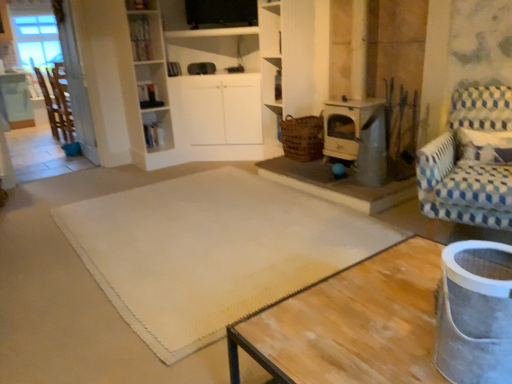
Measure the distance between brown woven basket at center-right and camera.

brown woven basket at center-right is 12.67 feet from camera.

Describe the element at coordinates (56, 105) in the screenshot. I see `wooden chair at left, which is the second chair in front-to-back order` at that location.

Consider the image. In order to face metallic stove at center-right, should I rotate leftwards or rightwards?

It's best to rotate right around 15.098 degrees.

Image resolution: width=512 pixels, height=384 pixels. I want to click on metallic stove at center-right, so click(358, 137).

This screenshot has height=384, width=512. What do you see at coordinates (211, 251) in the screenshot?
I see `white textured mat at center` at bounding box center [211, 251].

Locate an element on the screen. The width and height of the screenshot is (512, 384). brown woven basket at center-right is located at coordinates (302, 137).

Which is in front, point (284, 151) or point (16, 123)?

The point (284, 151) is closer to the camera.

Who is bigger, brown woven basket at center-right or brushed metal table at left?

brushed metal table at left.

From the picture: Is brushed metal table at left at the back of brown woven basket at center-right?

No.

From a real-world perspective, is brown woven basket at center-right located higher than brushed metal table at left?

Actually, brown woven basket at center-right is physically below brushed metal table at left in the real world.

From a real-world perspective, which is physically below, brushed metal table at left or wooden chair at left, the 1th chair in the back-to-front sequence?

From a 3D spatial view, brushed metal table at left is below.

What's the angular difference between brushed metal table at left and wooden chair at left, the 1th chair in the back-to-front sequence,'s facing directions?

There is a 87.9-degree angle between the facing directions of brushed metal table at left and wooden chair at left, the 1th chair in the back-to-front sequence.

Is point (19, 82) closer or farther from the camera than point (49, 102)?

Point (19, 82) appears to be farther away from the viewer than point (49, 102).

Is brushed metal table at left in contact with wooden chair at left, which is counted as the first chair, starting from the left?

No, brushed metal table at left is not with wooden chair at left, which is counted as the first chair, starting from the left.

Is wooden chair at left, which is counted as the first chair, starting from the left, to the left of brushed metal table at left from the viewer's perspective?

No.

In terms of width, does wooden chair at left, the first chair viewed from the top, look wider or thinner when compared to brushed metal table at left?

Considering their sizes, wooden chair at left, the first chair viewed from the top, looks slimmer than brushed metal table at left.

Is the depth of wooden chair at left, which is the second chair in front-to-back order, greater than that of brushed metal table at left?

No, it is in front of brushed metal table at left.

From a real-world perspective, does wooden chair at left, the 1th chair in the back-to-front sequence, sit lower than brushed metal table at left?

No.

Looking at this image, which is closer to the camera, (56, 66) or (468, 219)?

Point (56, 66) is farther from the camera than point (468, 219).

Could you tell me if wooden chair at left, which is the second chair in front-to-back order, is turned towards blue and white checkered fabric armchair at right, positioned as the 1th chair in right-to-left order?

No.

Is wooden chair at left, which appears as the 2th chair when ordered from the bottom, closer to camera compared to blue and white checkered fabric armchair at right, positioned as the 1th chair in right-to-left order?

That is False.

From the image's perspective, is wooden chair at left, the 1th chair in the back-to-front sequence, below blue and white checkered fabric armchair at right, arranged as the first chair when viewed from the front?

No, from the image's perspective, wooden chair at left, the 1th chair in the back-to-front sequence, is not beneath blue and white checkered fabric armchair at right, arranged as the first chair when viewed from the front.

In terms of width, does white glossy bookshelf at upper center look wider or thinner when compared to brown woven basket at center-right?

Clearly, white glossy bookshelf at upper center has less width compared to brown woven basket at center-right.

Considering the positions of objects white glossy bookshelf at upper center and brown woven basket at center-right in the image provided, who is more to the left, white glossy bookshelf at upper center or brown woven basket at center-right?

From the viewer's perspective, white glossy bookshelf at upper center appears more on the left side.

Which of these two, white glossy bookshelf at upper center or brown woven basket at center-right, is bigger?

Bigger between the two is brown woven basket at center-right.

From the image's perspective, which one is positioned lower, white glossy bookshelf at upper center or brown woven basket at center-right?

brown woven basket at center-right.

Considering the points (27, 125) and (127, 7), which point is in front, point (27, 125) or point (127, 7)?

The point (127, 7) is closer to the camera.

Find the location of `table that is behind the white glossy bookshelf at upper center`. table that is behind the white glossy bookshelf at upper center is located at coordinates (16, 101).

Can you tell me how much brushed metal table at left and white glossy bookshelf at upper center differ in facing direction?

1.19 degrees.

In terms of height, does brushed metal table at left look taller or shorter compared to white glossy bookshelf at upper center?

Clearly, brushed metal table at left is taller compared to white glossy bookshelf at upper center.

Is white glossy bookshelf at upper center taller or shorter than brushed metal table at left?

white glossy bookshelf at upper center is shorter than brushed metal table at left.

The image size is (512, 384). Find the location of `table behind the white glossy bookshelf at upper center`. table behind the white glossy bookshelf at upper center is located at coordinates (16, 101).

Is white glossy bookshelf at upper center oriented towards brushed metal table at left?

No, white glossy bookshelf at upper center is not turned towards brushed metal table at left.

Is white glossy bookshelf at upper center located outside brushed metal table at left?

Indeed, white glossy bookshelf at upper center is completely outside brushed metal table at left.

At what (x,y) coordinates should I click in order to perform the action: click on basket below the brushed metal table at left (from a real-world perspective). Please return your answer as a coordinate pair (x, y). This screenshot has height=384, width=512. Looking at the image, I should click on (302, 137).

In order to click on table located above the wooden chair at left, which appears as the 2th chair when ordered from the bottom (from the image's perspective) in this screenshot , I will do `click(16, 101)`.

Considering their positions, is brown woven basket at center-right positioned further to white glossy bookshelf at upper center than metallic stove at center-right?

metallic stove at center-right.

Looking at the image, which one is located further to blue and white checkered fabric armchair at right, arranged as the first chair when viewed from the front, brushed metal table at left or metallic stove at center-right?

brushed metal table at left lies further to blue and white checkered fabric armchair at right, arranged as the first chair when viewed from the front, than the other object.

Based on their spatial positions, is blue and white checkered fabric armchair at right, acting as the 2th chair starting from the top, or white glossy bookshelf at upper center further from brushed metal table at left?

blue and white checkered fabric armchair at right, acting as the 2th chair starting from the top, is positioned further to the anchor brushed metal table at left.

Based on their spatial positions, is blue and white checkered fabric armchair at right, arranged as the first chair when viewed from the front, or white textured mat at center closer to brown woven basket at center-right?

white textured mat at center is closer to brown woven basket at center-right.

Based on their spatial positions, is brown woven basket at center-right or blue and white checkered fabric armchair at right, acting as the second chair starting from the left, closer to white glossy bookshelf at upper center?

Based on the image, brown woven basket at center-right appears to be nearer to white glossy bookshelf at upper center.

Looking at the image, which one is located further to wooden chair at left, which appears as the 2th chair when ordered from the bottom, white textured mat at center or blue and white checkered fabric armchair at right, acting as the second chair starting from the left?

blue and white checkered fabric armchair at right, acting as the second chair starting from the left, lies further to wooden chair at left, which appears as the 2th chair when ordered from the bottom, than the other object.

Based on their spatial positions, is white glossy bookshelf at upper center or brown woven basket at center-right further from wooden chair at left, which is the second chair in front-to-back order?

Among the two, brown woven basket at center-right is located further to wooden chair at left, which is the second chair in front-to-back order.

Estimate the real-world distances between objects in this image. Which object is further from brushed metal table at left, white textured mat at center or brown woven basket at center-right?

Based on the image, white textured mat at center appears to be further to brushed metal table at left.

The width and height of the screenshot is (512, 384). In order to click on basket between brushed metal table at left and metallic stove at center-right from left to right in this screenshot , I will do `click(302, 137)`.

The image size is (512, 384). Identify the location of shelf between wooden chair at left, which is the second chair in front-to-back order, and metallic stove at center-right. (140, 5).

Image resolution: width=512 pixels, height=384 pixels. In order to click on basket between wooden chair at left, the first chair viewed from the top, and blue and white checkered fabric armchair at right, placed as the first chair when sorted from bottom to top in this screenshot , I will do `click(302, 137)`.

Locate an element on the screen. This screenshot has height=384, width=512. shelf located between brushed metal table at left and blue and white checkered fabric armchair at right, arranged as the first chair when viewed from the front, in the left-right direction is located at coordinates (140, 5).